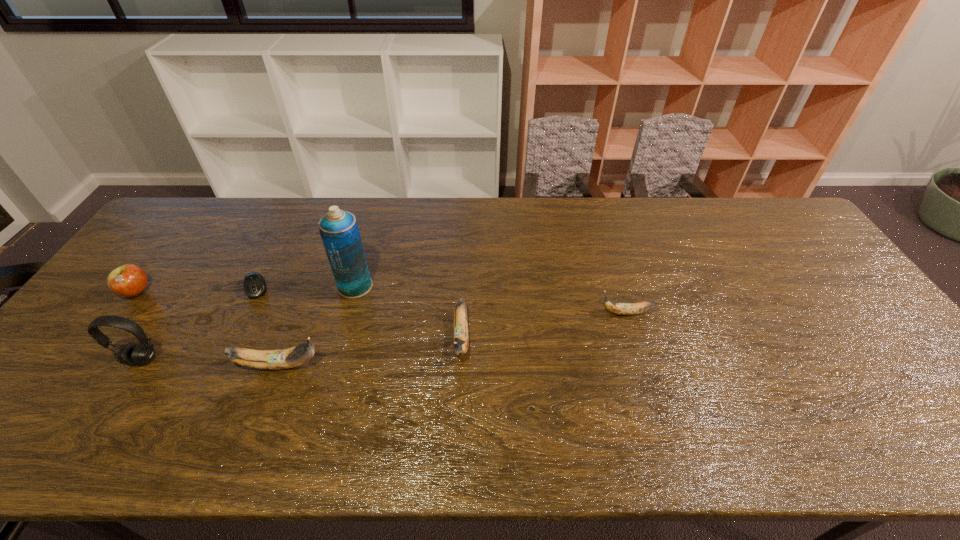
Find the location of a particular element. The height and width of the screenshot is (540, 960). the third tallest object is located at coordinates (291, 357).

Find the location of `the tallest banana`. the tallest banana is located at coordinates (291, 357).

Image resolution: width=960 pixels, height=540 pixels. I want to click on the sixth object from left to right, so click(x=460, y=343).

Find the location of a particular element. the fourth shortest object is located at coordinates [x=460, y=343].

Where is `the shortest banana`? The height and width of the screenshot is (540, 960). the shortest banana is located at coordinates (617, 308).

Find the location of `the rightmost banana`. the rightmost banana is located at coordinates (617, 308).

At what (x,y) coordinates should I click in order to perform the action: click on mouse. Please return your answer as a coordinate pair (x, y). The width and height of the screenshot is (960, 540). Looking at the image, I should click on pyautogui.click(x=254, y=286).

Locate an element on the screen. This screenshot has width=960, height=540. headset is located at coordinates (142, 353).

In order to click on the second object from left to right in this screenshot , I will do `click(142, 353)`.

At what (x,y) coordinates should I click in order to perform the action: click on aerosol can. Please return your answer as a coordinate pair (x, y). Image resolution: width=960 pixels, height=540 pixels. Looking at the image, I should click on (339, 231).